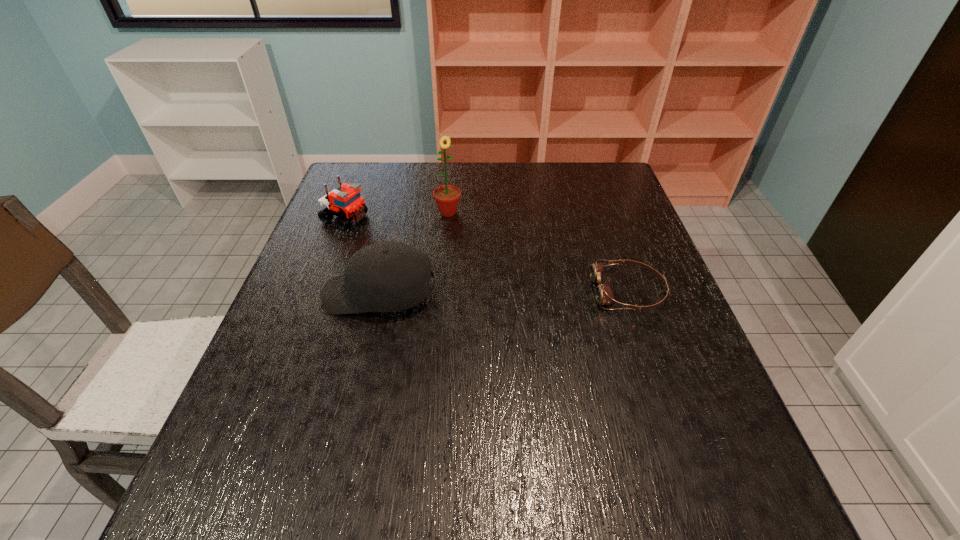
Point out which object is positioned as the second nearest to the Lego. Please provide its 2D coordinates. Your answer should be formatted as a tuple, i.e. [(x, y)], where the tuple contains the x and y coordinates of a point satisfying the conditions above.

[(447, 197)]

What are the coordinates of `vacant space that satisfies the following two spatial constraints: 1. on the back side of the sunflower; 2. on the left side of the Lego` in the screenshot? It's located at (348, 212).

Locate an element on the screen. The height and width of the screenshot is (540, 960). free space that satisfies the following two spatial constraints: 1. on the front side of the Lego; 2. with a logo on the front of the baseball cap is located at coordinates (316, 294).

The height and width of the screenshot is (540, 960). Find the location of `free spot that satisfies the following two spatial constraints: 1. on the front side of the baseball cap; 2. with a logo on the front of the Lego`. free spot that satisfies the following two spatial constraints: 1. on the front side of the baseball cap; 2. with a logo on the front of the Lego is located at coordinates (316, 294).